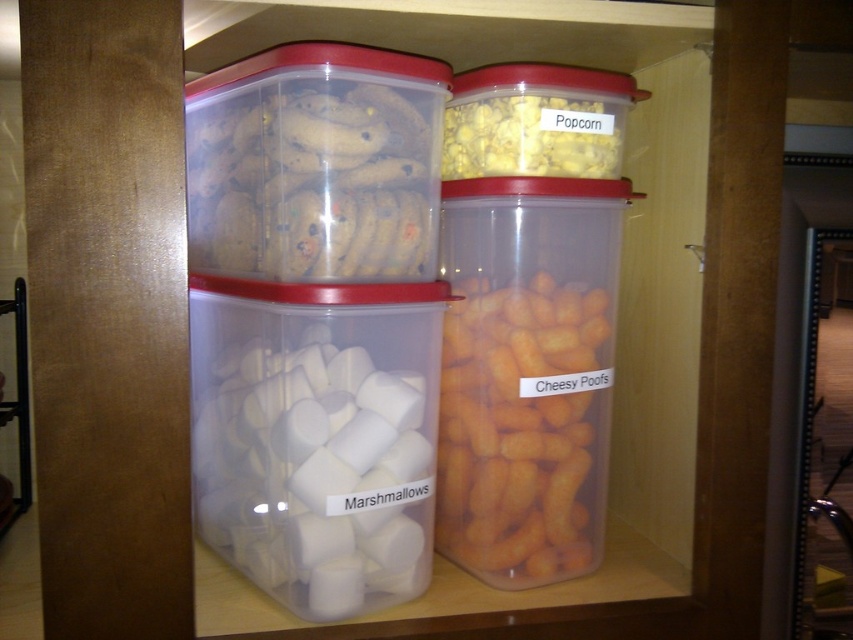
You are a delivery person who needs to place a new container on the shelf. The container you have is 7 inches wide. Can you fit it between the white matte marshmallows at center and the translucent plastic cookies at upper left without moving any existing containers?

The distance between the white matte marshmallows at center and the translucent plastic cookies at upper left is 6.65 inches. Since the new container is 7 inches wide, it cannot fit in the space between them as the available space is slightly smaller than the container.

You are standing in front of a shelf with containers. You need to reach the translucent plastic cookies at upper left, which is 25.74 inches from the camera. If your arm can extend 24 inches, can you reach it?

The translucent plastic cookies at upper left is 25.74 inches from the camera, which is beyond your arm extension of 24 inches. You cannot reach it.